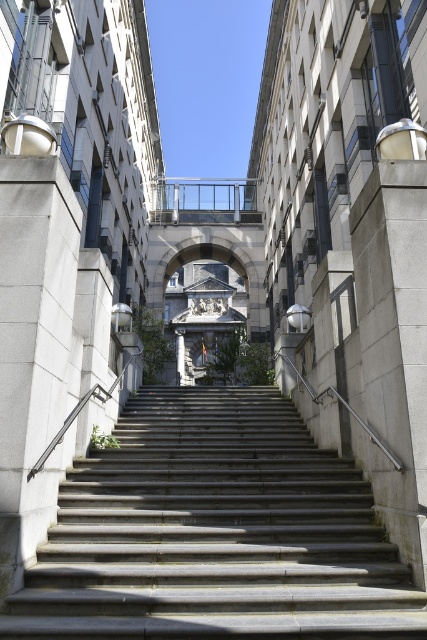
Is point (90, 557) closer to viewer compared to point (248, 211)?

Yes.

The height and width of the screenshot is (640, 427). Identify the location of gray concrete stairs at center. (215, 532).